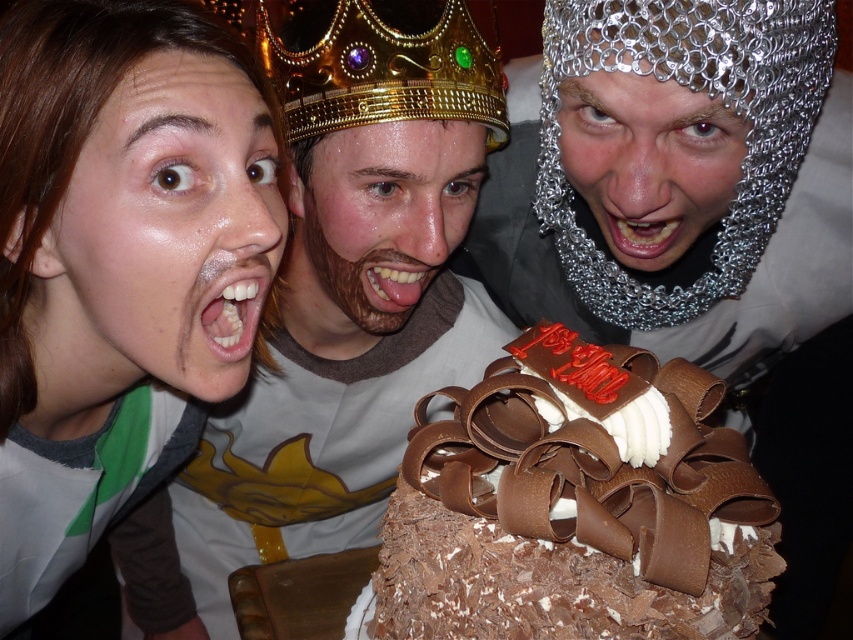
Question: Among these objects, which one is farthest from the camera?

Choices:
 (A) matte brown hair at left
 (B) chainmail helmet at center
 (C) metallic chainmail mouth at center

Answer: (C)

Question: Which object is positioned closest to the gold metallic crown at center?

Choices:
 (A) satin skin face at upper left
 (B) white glossy teeth at center
 (C) shiny gold crown at center

Answer: (C)

Question: Is gold metallic crown at center further to camera compared to metallic chainmail mouth at center?

Choices:
 (A) no
 (B) yes

Answer: (B)

Question: Can you confirm if satin skin face at upper left is bigger than gold metallic crown at center?

Choices:
 (A) yes
 (B) no

Answer: (A)

Question: Which point is farther to the camera?

Choices:
 (A) satin skin face at upper left
 (B) gold metallic crown at center
 (C) chainmail helmet at center
 (D) metallic chainmail mouth at center

Answer: (B)

Question: Can you confirm if chainmail helmet at center is positioned above white glossy teeth at center?

Choices:
 (A) yes
 (B) no

Answer: (A)